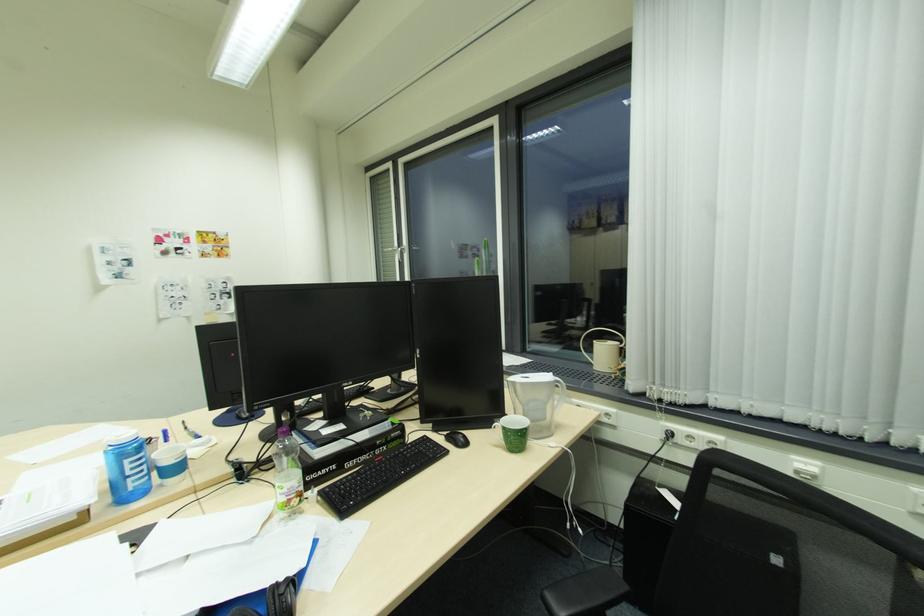
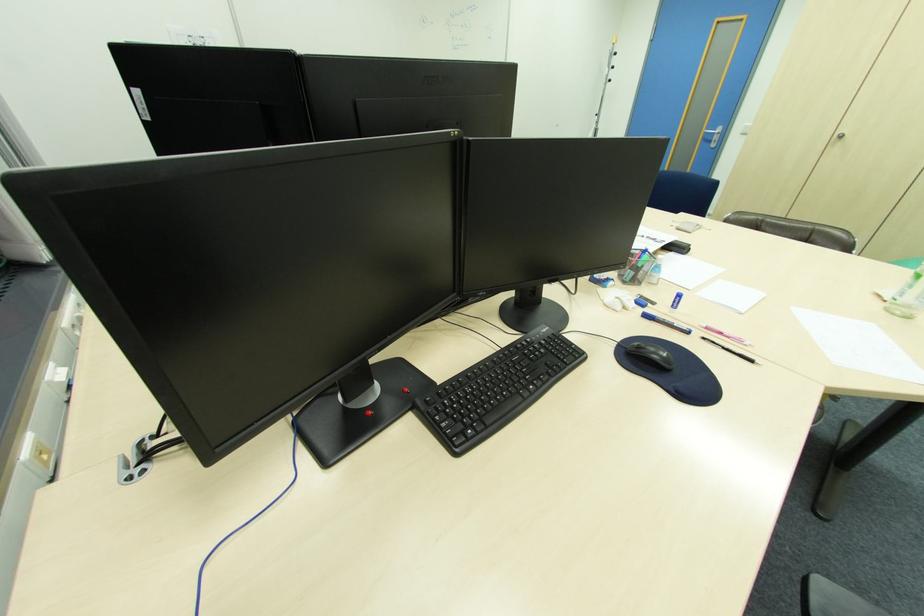
Question: I am providing you with two images of the same scene from different viewpoints. After the viewpoint changes to image2, which objects are now occluded?

Choices:
 (A) black pencil
 (B) yellow bicycle handlebar
 (C) plastic drink bottle
 (D) black computer mouse

Answer: (C)